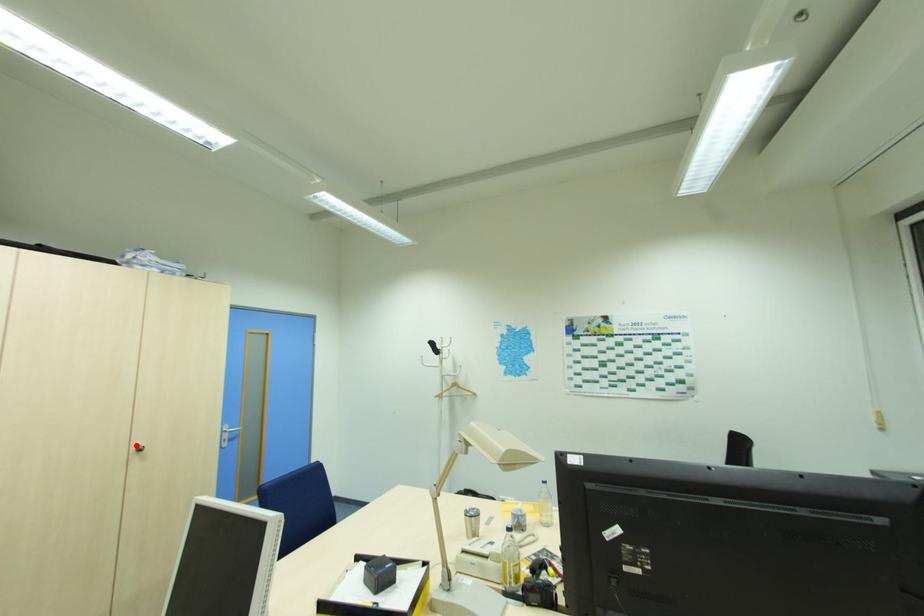
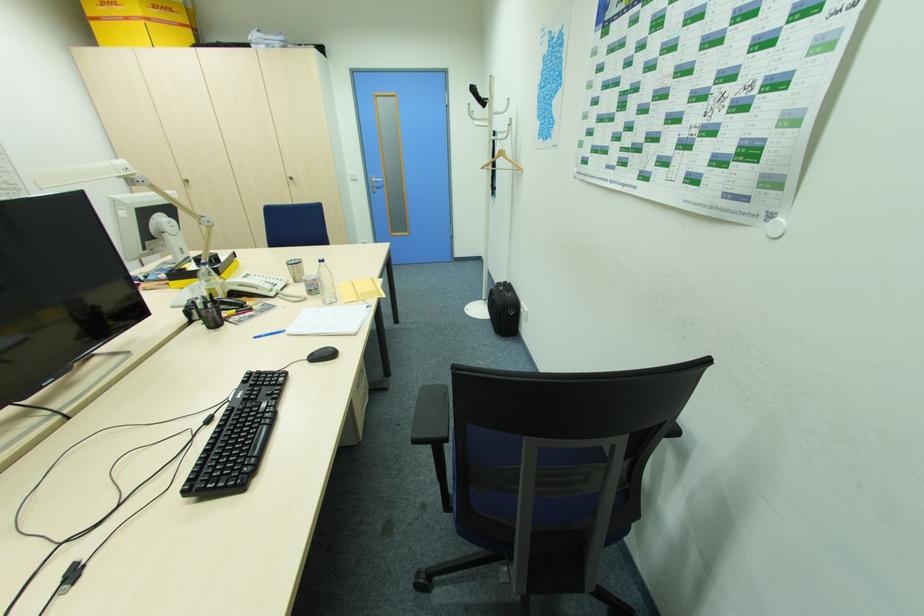
Where in the second image is the point corresponding to the highlighted location from the first image?

(292, 176)